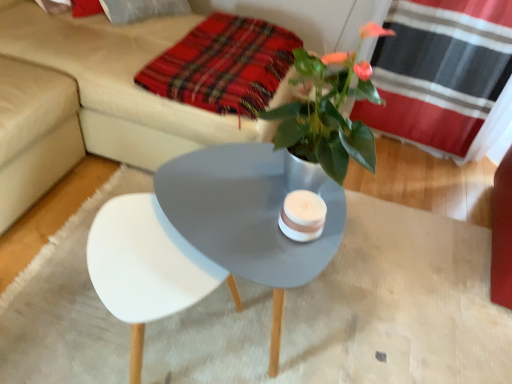
Where is `vacant space to the left of metallic silver plant at center`? vacant space to the left of metallic silver plant at center is located at coordinates (208, 182).